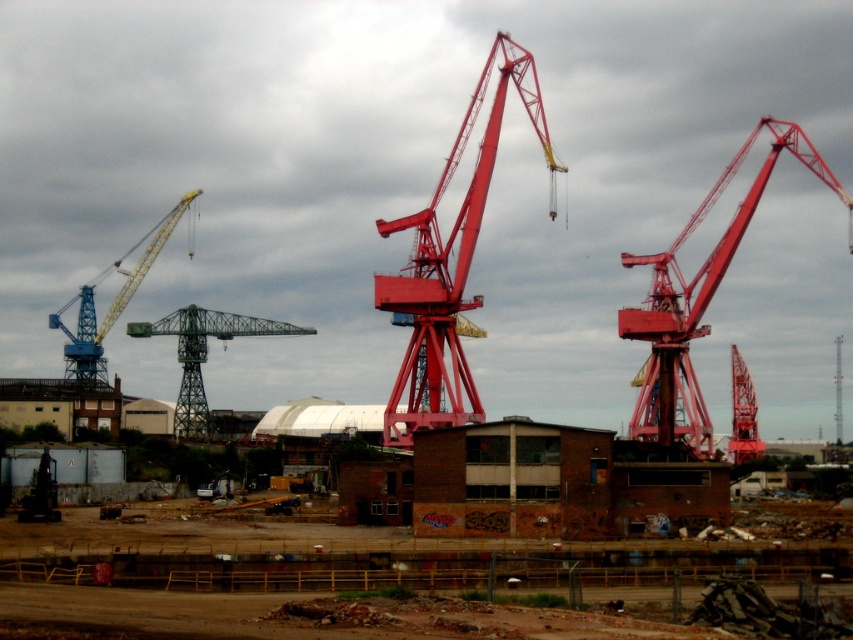
Is brick wall at center to the right of metallic red crane at right from the viewer's perspective?

In fact, brick wall at center is to the left of metallic red crane at right.

Does brick wall at center have a lesser width compared to metallic red crane at right?

Incorrect, brick wall at center's width is not less than metallic red crane at right's.

Between point (262, 561) and point (700, 307), which one is positioned behind?

The point (700, 307) is more distant.

Locate an element on the screen. This screenshot has width=853, height=640. brick wall at center is located at coordinates (590, 508).

Which of these two, metallic red crane at center or metallic red crane at right, stands taller?

Standing taller between the two is metallic red crane at right.

Can you confirm if metallic red crane at center is thinner than metallic red crane at right?

Yes.

This screenshot has width=853, height=640. Describe the element at coordinates (453, 266) in the screenshot. I see `metallic red crane at center` at that location.

What are the coordinates of `metallic red crane at center` in the screenshot? It's located at (453, 266).

Is green metallic crane at center above matte red crane at right?

Correct, green metallic crane at center is located above matte red crane at right.

Where is `green metallic crane at center`? green metallic crane at center is located at coordinates (202, 355).